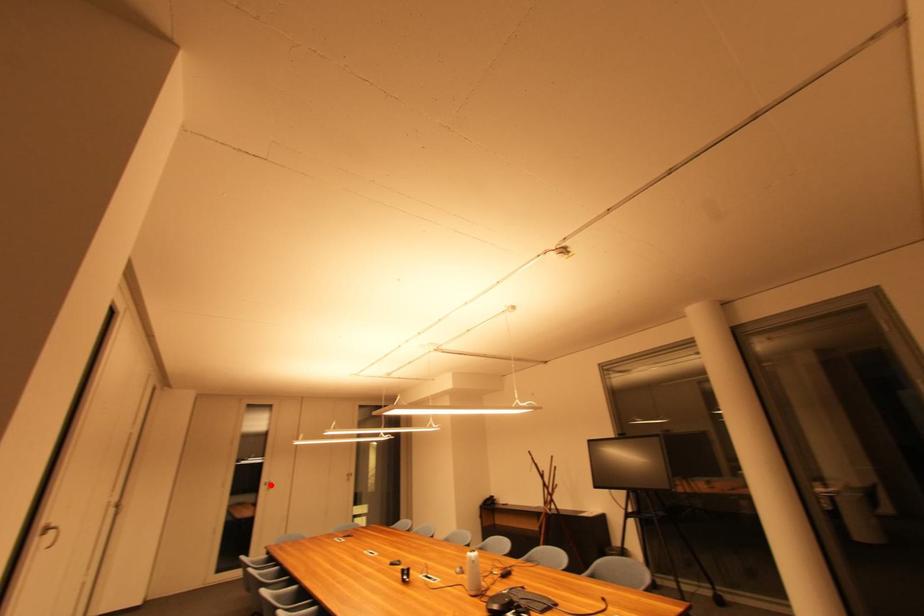
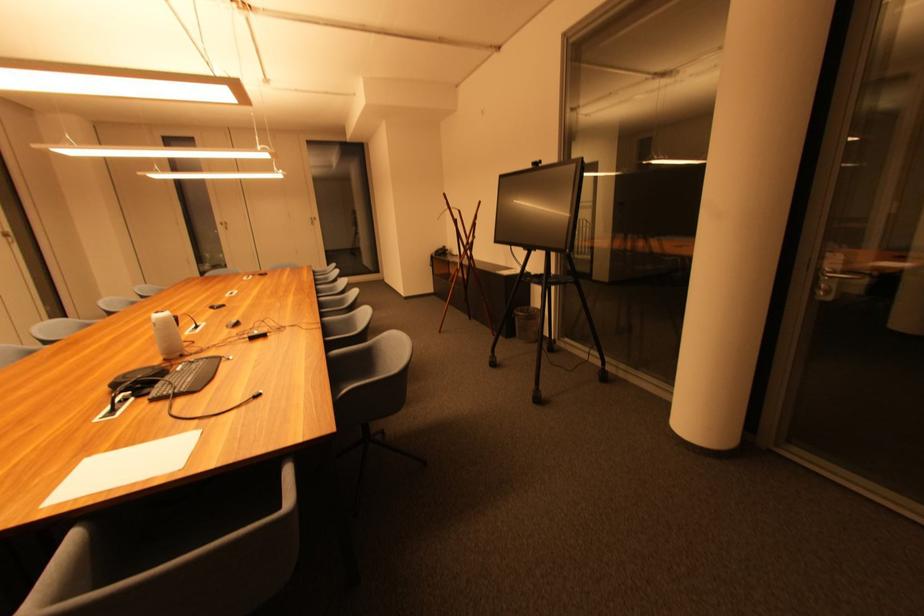
Find the pixel in the second image that matches the highlighted location in the first image.

(226, 225)